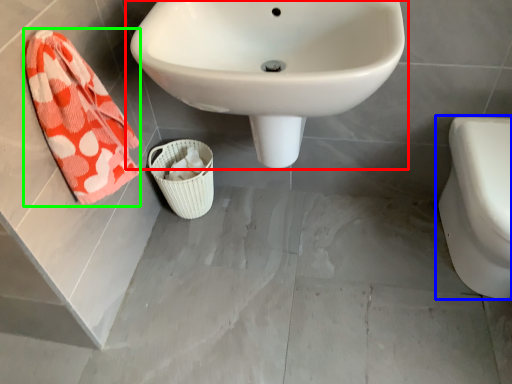
Question: Estimate the real-world distances between objects in this image. Which object is closer to sink (highlighted by a red box), toilet (highlighted by a blue box) or beach towel (highlighted by a green box)?

Choices:
 (A) toilet
 (B) beach towel

Answer: (B)